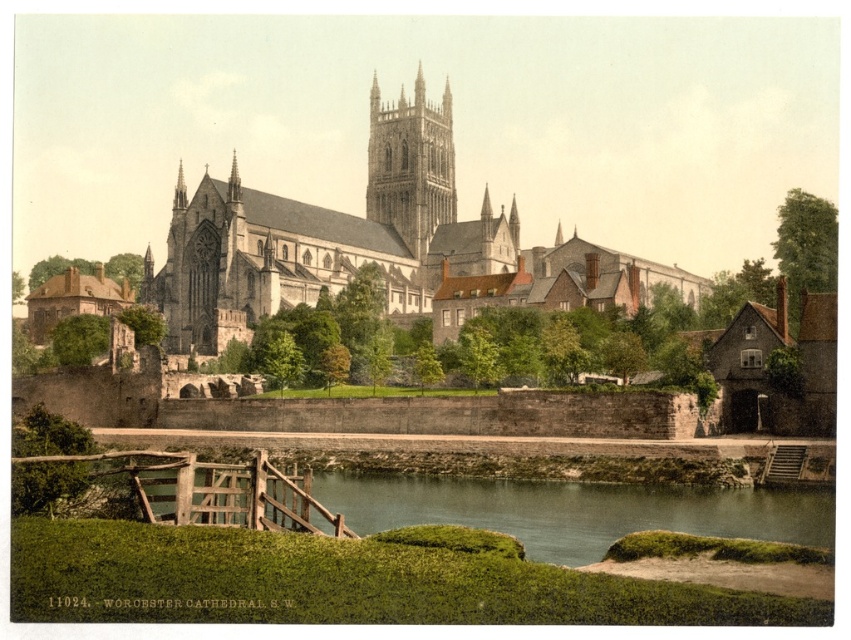
Question: Which of the following is the closest to the observer?

Choices:
 (A) brown stone tower at center
 (B) green grassy bank at lower center
 (C) white stone church at center

Answer: (B)

Question: Is the position of white stone church at center more distant than that of green grassy bank at lower center?

Choices:
 (A) yes
 (B) no

Answer: (A)

Question: Among these objects, which one is farthest from the camera?

Choices:
 (A) green grassy bank at lower center
 (B) white stone church at center
 (C) brown stone tower at center

Answer: (C)

Question: Can you confirm if white stone church at center is positioned to the right of green grassy bank at lower center?

Choices:
 (A) no
 (B) yes

Answer: (A)

Question: Is white stone church at center to the right of green grassy bank at lower center from the viewer's perspective?

Choices:
 (A) no
 (B) yes

Answer: (A)

Question: Which object appears farthest from the camera in this image?

Choices:
 (A) green grassy bank at lower center
 (B) white stone church at center

Answer: (B)